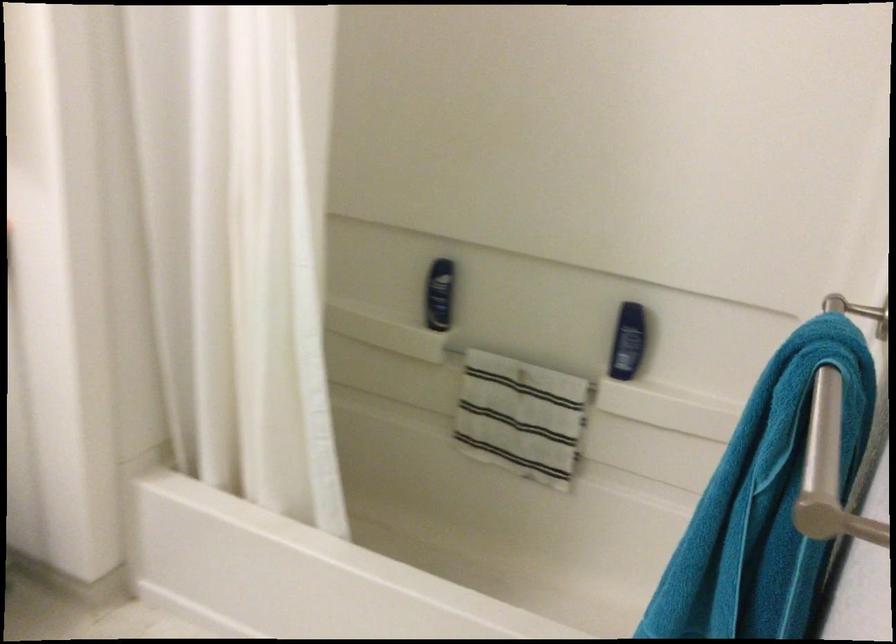
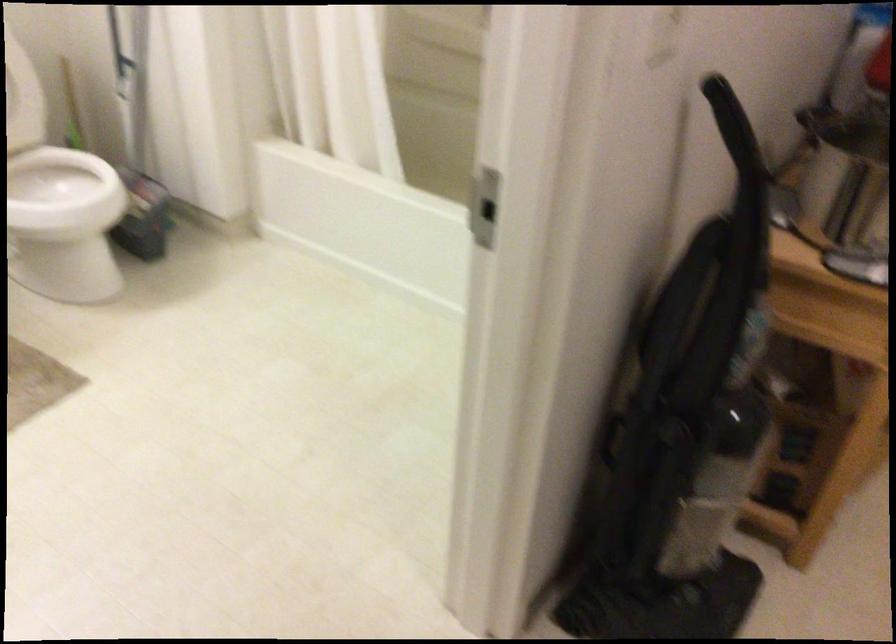
Consider the image. What movement of the cameraman would produce the second image?

The cameraman walked toward right, backward.